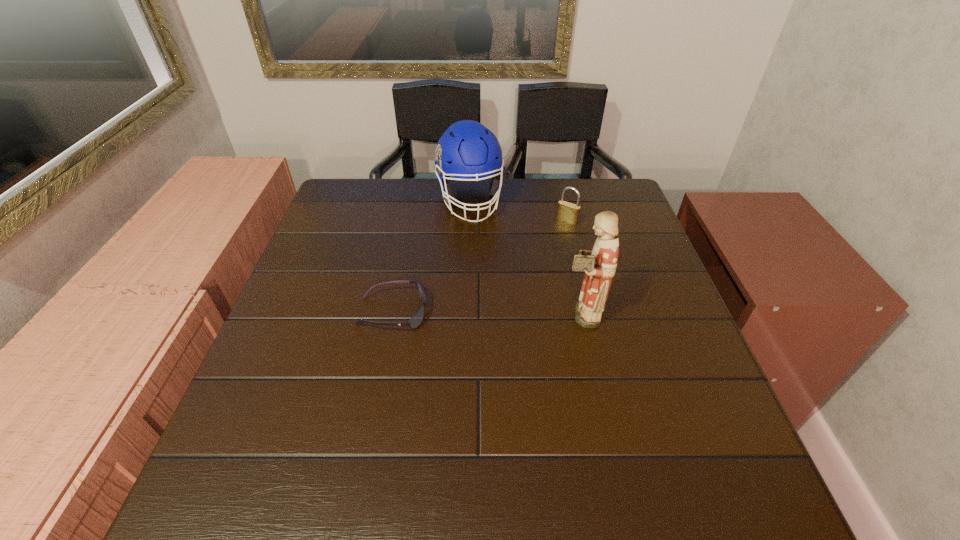
The height and width of the screenshot is (540, 960). In order to click on vacant region located on the front-facing side of the third tallest object in this screenshot , I will do `click(492, 310)`.

At what (x,y) coordinates should I click in order to perform the action: click on vacant area situated 0.240m on the front-facing side of the football helmet. Please return your answer as a coordinate pair (x, y). The width and height of the screenshot is (960, 540). Looking at the image, I should click on (492, 284).

Image resolution: width=960 pixels, height=540 pixels. Find the location of `vacant space located on the front-facing side of the football helmet`. vacant space located on the front-facing side of the football helmet is located at coordinates (500, 307).

The height and width of the screenshot is (540, 960). I want to click on blank area located 0.190m on the front-facing side of the football helmet, so click(489, 271).

You are a GUI agent. You are given a task and a screenshot of the screen. Output one action in this format:
    pyautogui.click(x=<x>, y=<y>)
    Task: Click on the padlock located at the far edge
    
    Given the screenshot: What is the action you would take?
    pyautogui.click(x=567, y=212)

Locate an element on the screen. The height and width of the screenshot is (540, 960). football helmet positioned at the far edge is located at coordinates (467, 150).

This screenshot has width=960, height=540. In the image, there is a desktop. In order to click on vacant space at the far edge in this screenshot , I will do `click(551, 179)`.

What are the coordinates of `free location at the near edge` in the screenshot? It's located at (369, 453).

Locate an element on the screen. vacant space at the left edge of the desktop is located at coordinates (355, 240).

You are a GUI agent. You are given a task and a screenshot of the screen. Output one action in this format:
    pyautogui.click(x=<x>, y=<y>)
    Task: Click on the blank space at the right edge
    This screenshot has width=960, height=540.
    Given the screenshot: What is the action you would take?
    pyautogui.click(x=626, y=310)